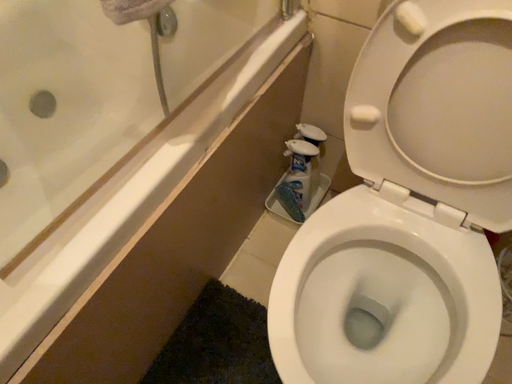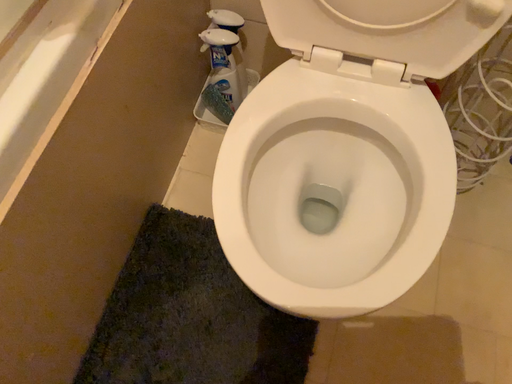
Question: Which way did the camera rotate in the video?

Choices:
 (A) rotated left
 (B) rotated right

Answer: (B)